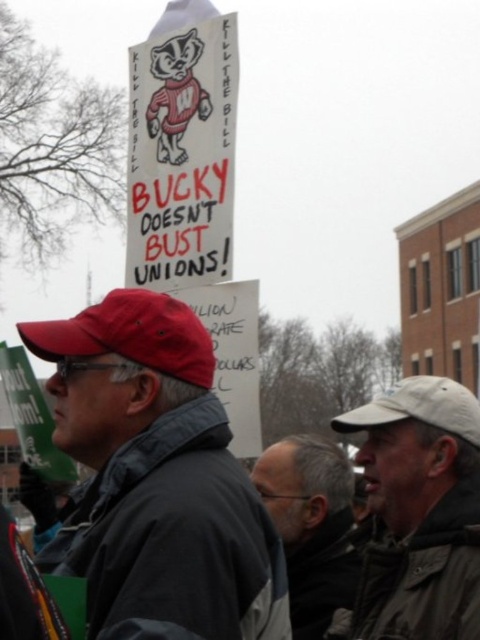
Is gray fabric jacket at lower center bigger than white fabric baseball cap at upper right?

No.

Who is higher up, gray fabric jacket at lower center or white fabric baseball cap at upper right?

Positioned higher is white fabric baseball cap at upper right.

Does point (356, 580) come behind point (434, 413)?

Yes, it is behind point (434, 413).

Where is `gray fabric jacket at lower center`? The image size is (480, 640). gray fabric jacket at lower center is located at coordinates (312, 525).

This screenshot has width=480, height=640. Find the location of `matte red baseball cap at center`. matte red baseball cap at center is located at coordinates (131, 333).

Between point (187, 332) and point (420, 406), which one is positioned in front?

Point (187, 332) is more forward.

Locate an element on the screen. Image resolution: width=480 pixels, height=640 pixels. matte red baseball cap at center is located at coordinates (131, 333).

Does red fabric cap at left have a lesser height compared to matte red baseball cap at center?

Incorrect, red fabric cap at left's height does not fall short of matte red baseball cap at center's.

Which is more to the left, red fabric cap at left or matte red baseball cap at center?

Positioned to the left is red fabric cap at left.

Is point (126, 296) farther from camera compared to point (130, 336)?

Yes, point (126, 296) is farther from viewer.

Where is `red fabric cap at left`? The image size is (480, 640). red fabric cap at left is located at coordinates (156, 474).